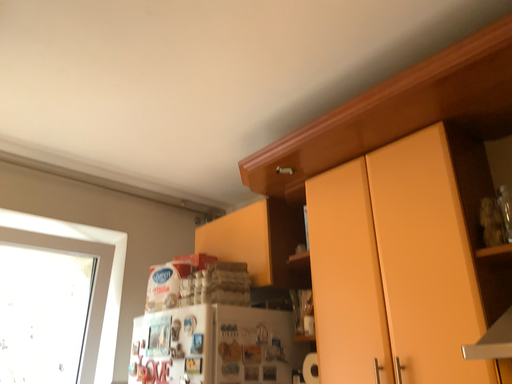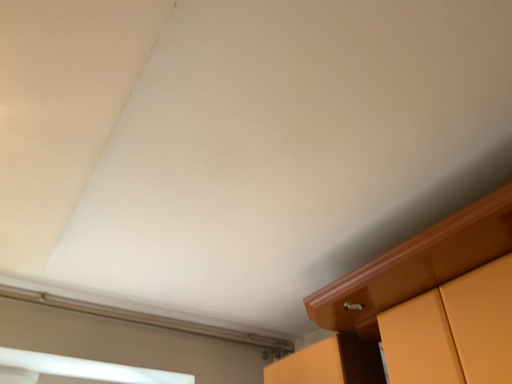
Question: Which way did the camera rotate in the video?

Choices:
 (A) rotated downward
 (B) rotated upward

Answer: (B)